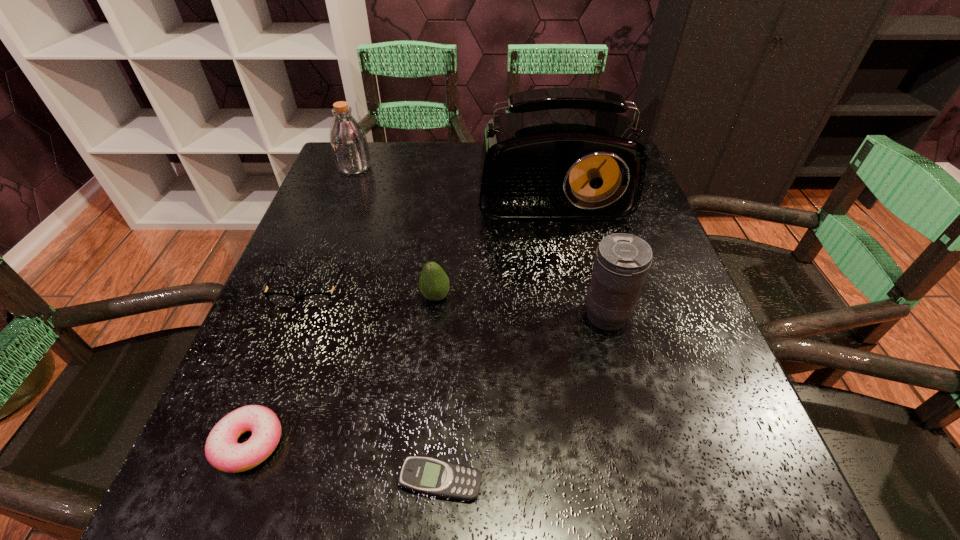
This screenshot has height=540, width=960. What are the coordinates of `free space located 0.090m on the side of the telephoto lens where the control switches are located` in the screenshot? It's located at (533, 315).

At what (x,y) coordinates should I click in order to perform the action: click on vacant space positioned 0.070m on the side of the telephoto lens where the control switches are located. Please return your answer as a coordinate pair (x, y). The image size is (960, 540). Looking at the image, I should click on (543, 315).

This screenshot has width=960, height=540. Identify the location of free point located on the back of the fourth shortest object. (445, 193).

Image resolution: width=960 pixels, height=540 pixels. Identify the location of vacant space located 0.320m on the front-facing side of the spectacles. (235, 488).

The width and height of the screenshot is (960, 540). Identify the location of free space located on the right of the doughnut. (450, 443).

Find the location of a particular element. This screenshot has width=960, height=540. vacant position located on the right of the shortest object is located at coordinates (592, 480).

The height and width of the screenshot is (540, 960). I want to click on radio receiver present at the far edge, so click(563, 153).

The image size is (960, 540). Identify the location of bottle that is positioned at the far edge. (348, 141).

Locate an element on the screen. doughnut at the near edge is located at coordinates click(222, 451).

This screenshot has width=960, height=540. I want to click on beeper present at the near edge, so click(435, 477).